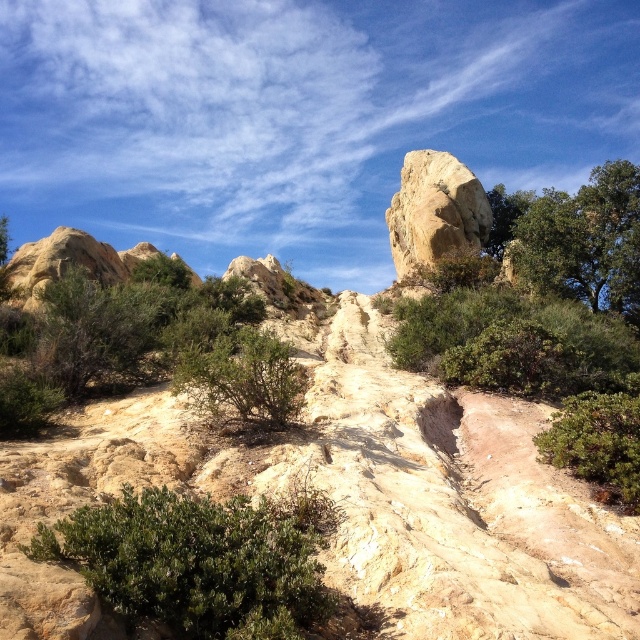
You are standing at the center of the rugged landscape and see the green leafy bush at lower left and the green leafy bush at lower right. Which bush is positioned closer to the bottom edge of the image?

The green leafy bush at lower left is positioned closer to the bottom edge of the image because it is below the green leafy bush at lower right.

You are standing at the center of the landscape and see the green leafy bush at lower left and the green leafy bush at lower right. Which one is closer to you?

The green leafy bush at lower left is closer to you because it is in front of the green leafy bush at lower right.

You are standing at point (579, 240) in the rugged landscape. What do you see around you?

At point (579, 240) lies green leafy tree at upper right.